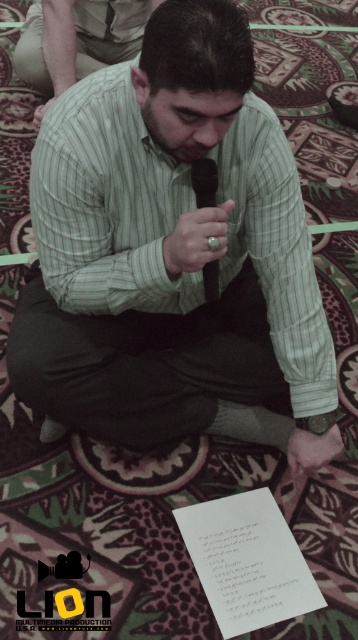
You are a fashion designer observing a man in a scene. You notice the green striped shirt at center and the black silk tie at center. Which clothing item is positioned higher on his body?

The green striped shirt at center is taller than the black silk tie at center, so the green striped shirt at center is positioned higher on his body.